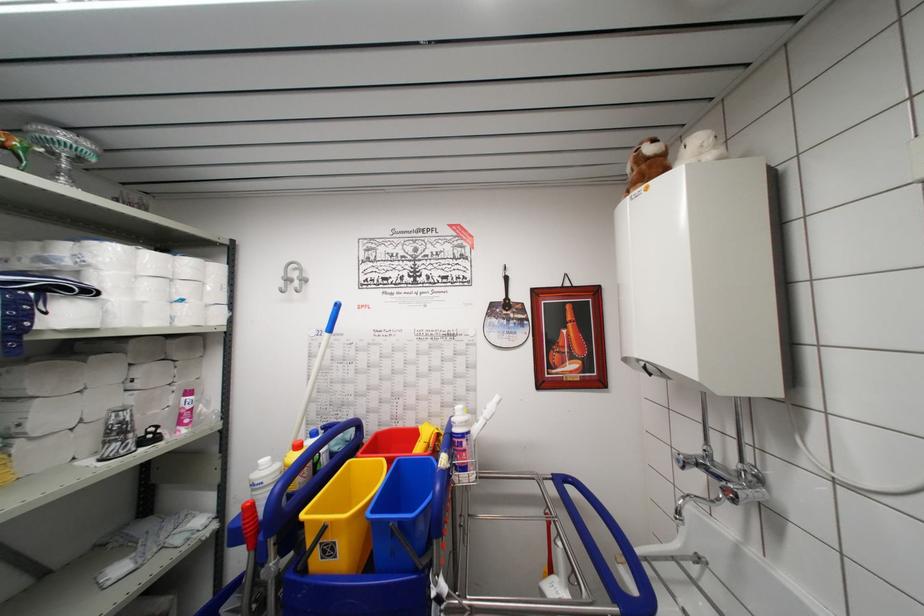
Which object does [402,515] point to?

This point indicates the blue bucket.